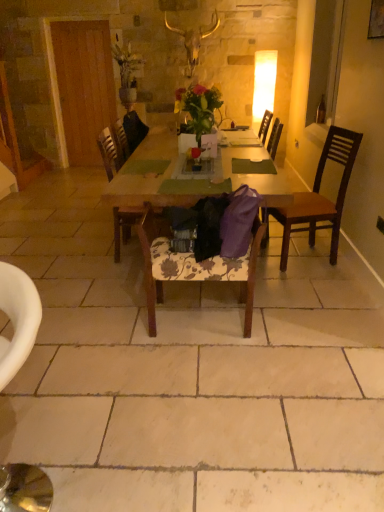
This screenshot has height=512, width=384. I want to click on vacant space in front of floral fabric chair at center, arranged as the second chair when viewed from the front, so click(202, 372).